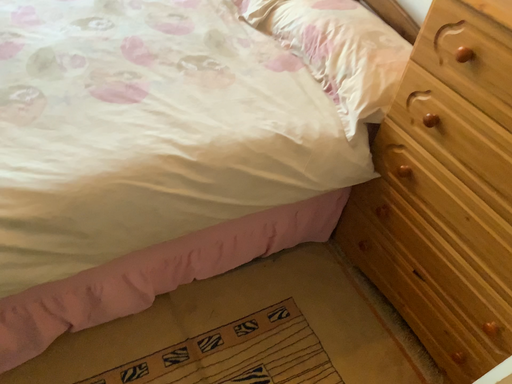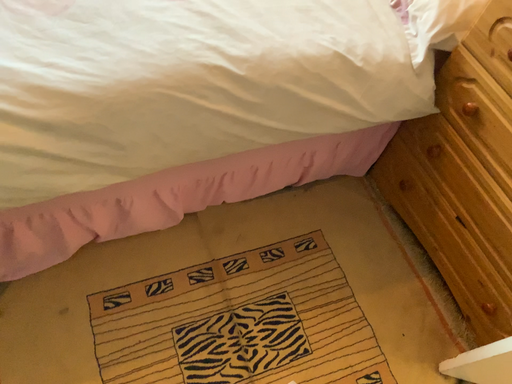
Question: Which way did the camera rotate in the video?

Choices:
 (A) rotated downward
 (B) rotated upward

Answer: (A)